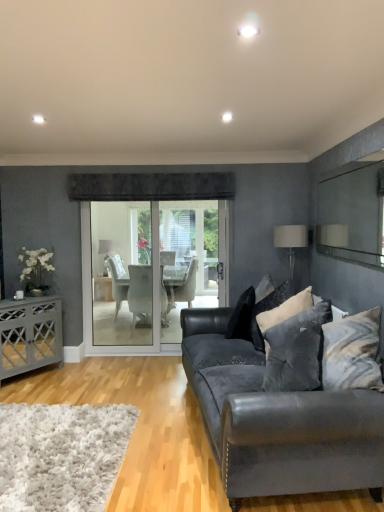
Question: In terms of size, does velvet black pillow at center, which is the third pillow from front to back, appear bigger or smaller than black velvet pillow at center, which ranks as the 4th pillow in front-to-back order?

Choices:
 (A) big
 (B) small

Answer: (A)

Question: Is velvet black pillow at center, which is the third pillow from front to back, inside or outside of black velvet pillow at center, acting as the 1th pillow starting from the back?

Choices:
 (A) outside
 (B) inside

Answer: (A)

Question: Which is nearer to the white fabric lampshade at upper right, which appears as the 2th lamp when viewed from the left?

Choices:
 (A) velvet black couch at lower right
 (B) velvet black pillow at center, the 2th pillow viewed from the back
 (C) matte gray cabinet at left
 (D) white fabric lampshade at center, which appears as the 2th lamp when viewed from the front
 (E) velvet gray pillow at center, arranged as the 3th pillow when viewed from the back

Answer: (B)

Question: Based on their relative distances, which object is nearer to the dark gray textured pillow at center right, the fourth pillow when ordered from back to front?

Choices:
 (A) white silk flower at left
 (B) clear glass mirror at upper right
 (C) matte gray cabinet at left
 (D) velvet black couch at lower right
 (E) white fabric lampshade at upper right, which is the 1th lamp in right-to-left order

Answer: (D)